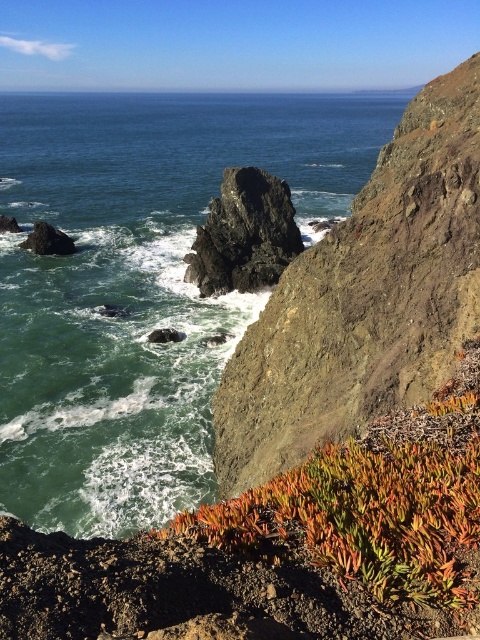
You are a drone operator tasked with capturing aerial footage of the coastal cliffs. Your drone has a maximum flight range of 300 feet from its starting point. If you position the drone at the rough gray cliff at center, can it reach the green water at center without exceeding its range?

The distance between the green water at center and the rough gray cliff at center is 365.04 feet. Since the drone has a maximum range of 300 feet, it cannot reach the green water at center without exceeding its range.

Based on the photo, you are a hiker standing at the base of the cliff. You see the green water at center and the green succulent at lower right. Which object is higher in elevation?

The green water at center is above the green succulent at lower right, so the green water at center is higher in elevation.

You are a photographer standing at the cliff edge. You want to capture both the green succulent at lower right and the green water at center in your shot. Which object will appear closer to the camera in the photo?

The green water at center will appear closer to the camera because the green succulent at lower right is positioned behind it.